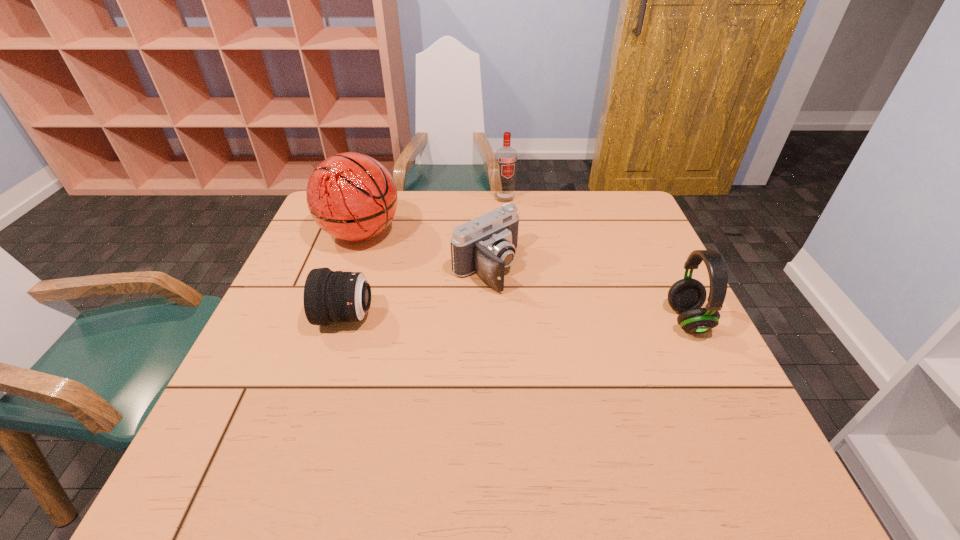
Identify the location of the second closest object relative to the camera. Image resolution: width=960 pixels, height=540 pixels. (329, 296).

Locate an element on the screen. The height and width of the screenshot is (540, 960). object that is the fourth closest to the third shortest object is located at coordinates (329, 296).

Where is `blank area in the image that satisfies the following two spatial constraints: 1. on the front side of the camera; 2. on the left side of the basketball`? This screenshot has height=540, width=960. blank area in the image that satisfies the following two spatial constraints: 1. on the front side of the camera; 2. on the left side of the basketball is located at coordinates (348, 268).